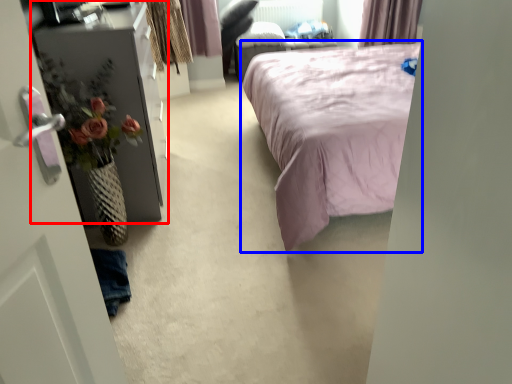
Question: Which of the following is the closest to the observer, furniture (highlighted by a red box) or bed (highlighted by a blue box)?

Choices:
 (A) furniture
 (B) bed

Answer: (B)